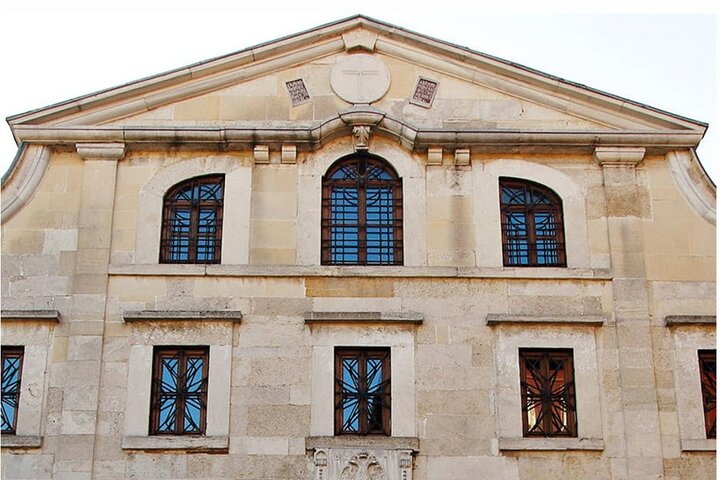
This screenshot has width=720, height=480. Identify the location of window ledge. (564, 444), (356, 439), (188, 437), (6, 442), (696, 444).